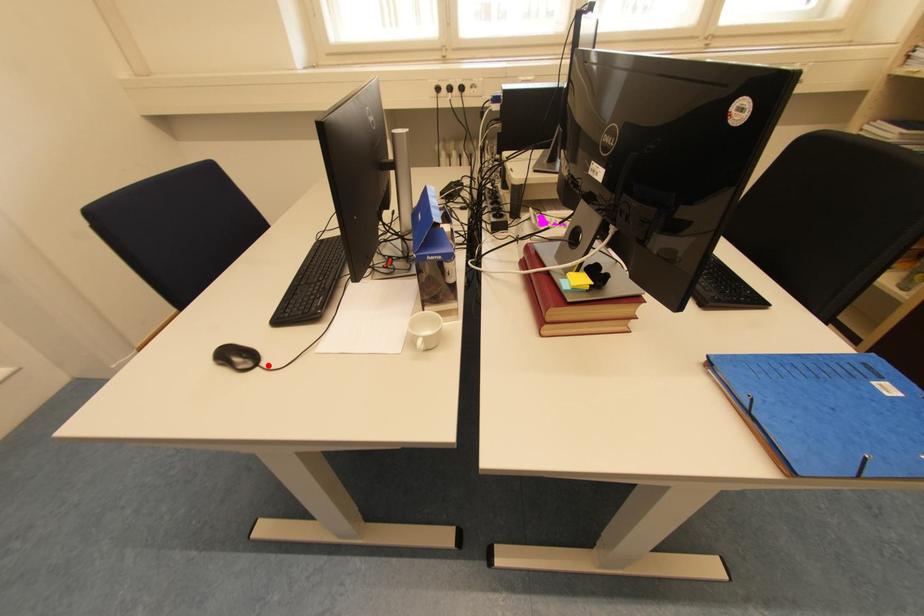
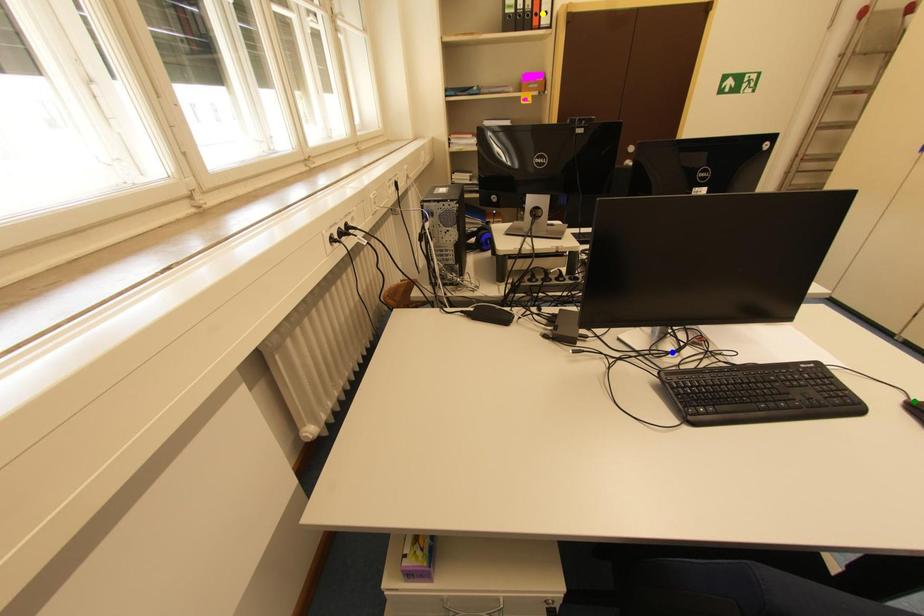
Question: I am providing you with two images of the same scene from different viewpoints. A red point is marked on the first image. You are given multiple points on the second image. Which point in image 2 represents the same 3d spot as the red point in image 1?

Choices:
 (A) yellow point
 (B) green point
 (C) blue point

Answer: (B)